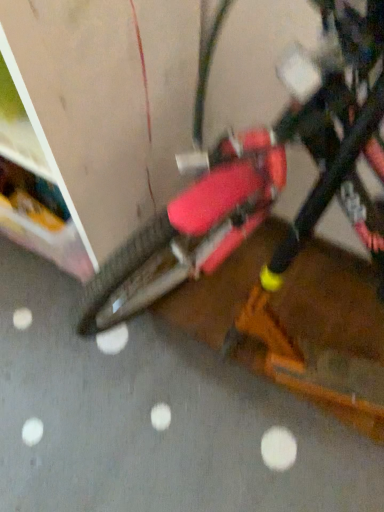
This screenshot has height=512, width=384. In order to click on blank space situated above matte orange scooter at center (from a real-world perspective) in this screenshot , I will do `click(164, 420)`.